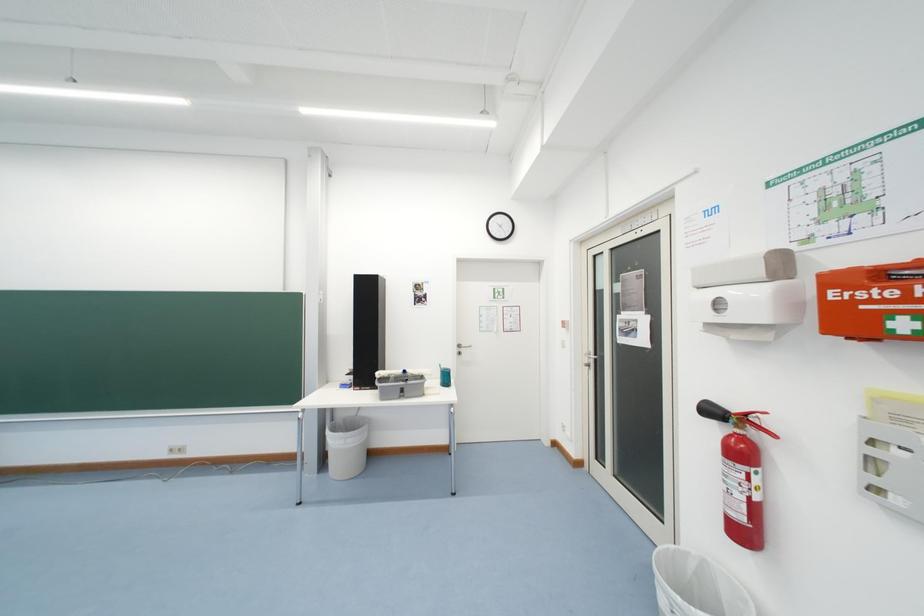
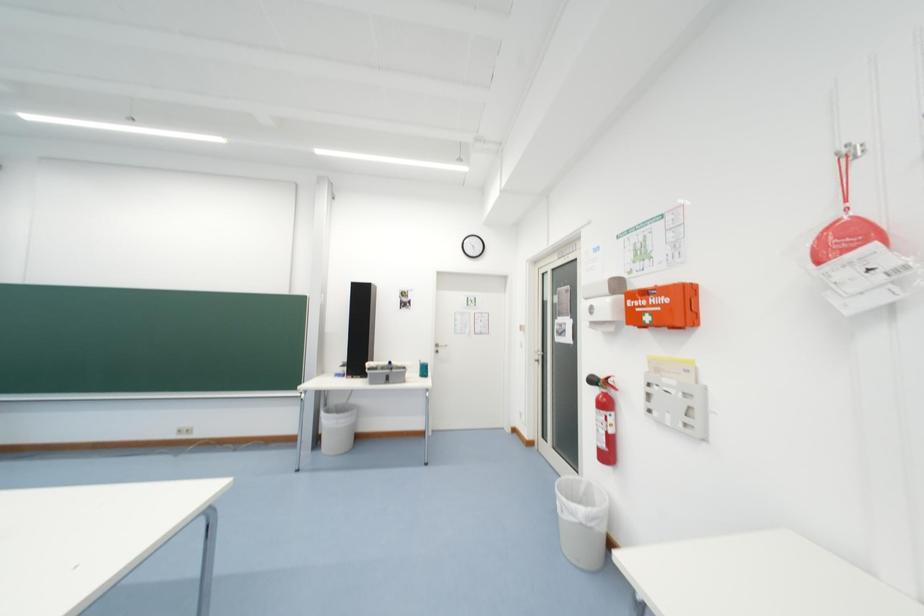
Question: The images are taken continuously from a first-person perspective. In which direction is your viewpoint rotating?

Choices:
 (A) Left
 (B) Right
 (C) Up
 (D) Down

Answer: (B)